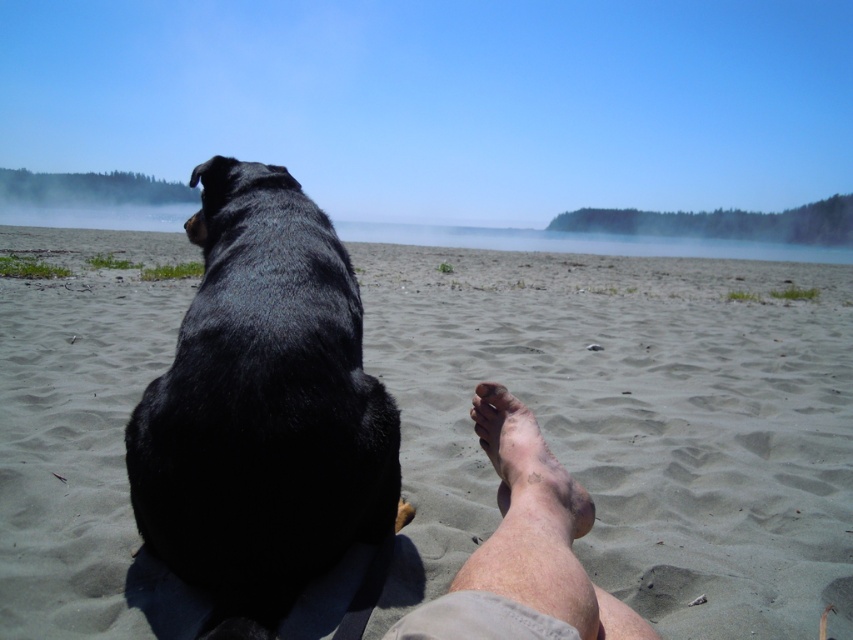
You are a photographer standing on the beach and want to take a photo of the sandy at upper center without the brown dirt foot at lower center appearing in the frame. Based on their positions, is it possible to adjust your position to achieve this?

The brown dirt foot at lower center is behind sandy at upper center, so moving your position slightly to the side might allow you to frame the sandy at upper center without the brown dirt foot at lower center blocking the view.

You are standing at the point with coordinates point (505, 627) and want to walk to the point with coordinates point (326, 484). Which direction should you move in to reach your destination?

To reach point (326, 484) from point (505, 627), you should move towards the upper left direction since point (326, 484) is behind point (505, 627).